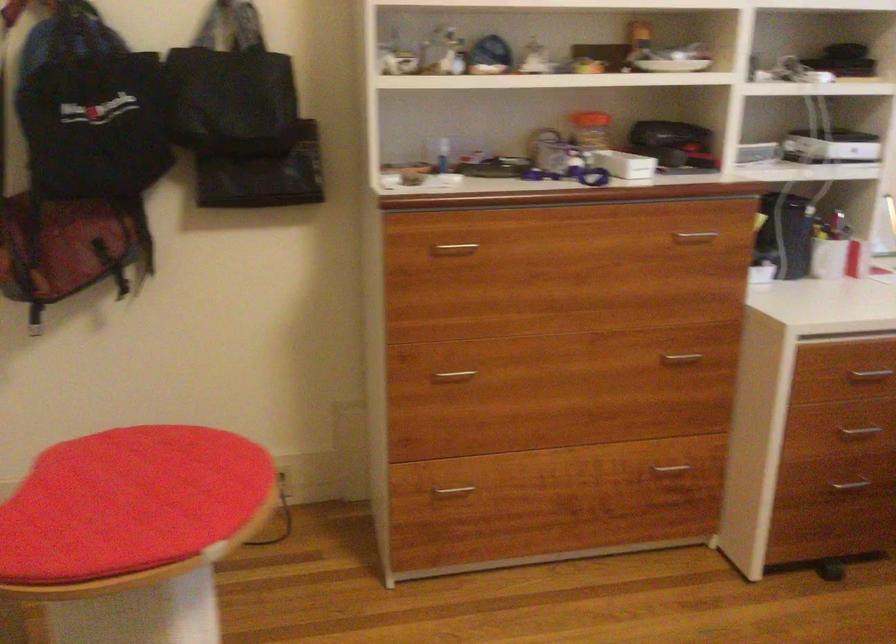
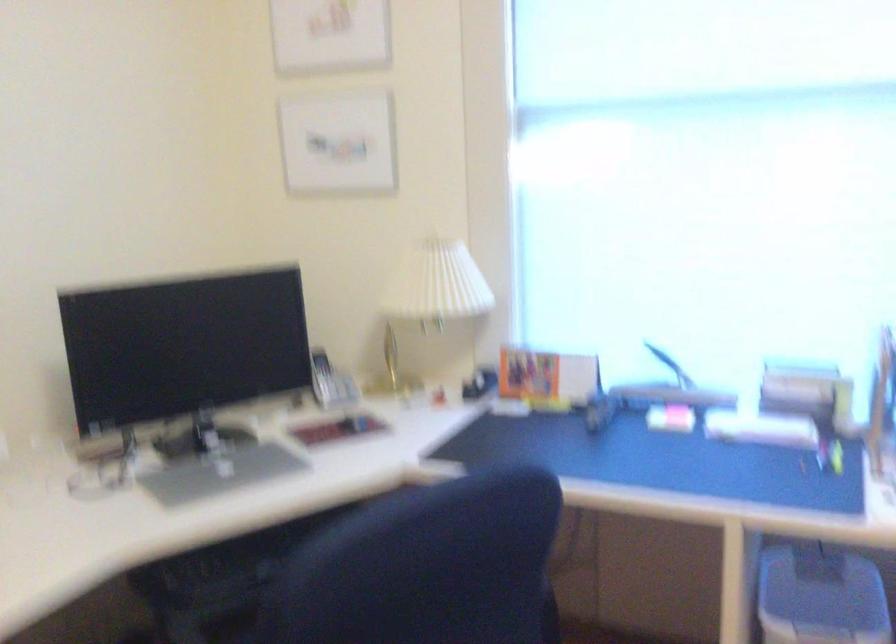
Question: How did the camera likely rotate?

Choices:
 (A) Left
 (B) Right
 (C) Up
 (D) Down

Answer: (B)